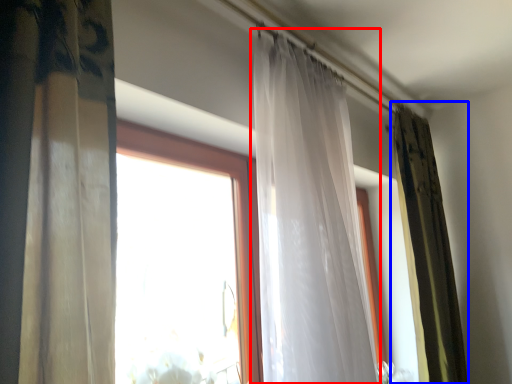
Question: Which object appears farthest to the camera in this image, curtain (highlighted by a red box) or curtain (highlighted by a blue box)?

Choices:
 (A) curtain
 (B) curtain

Answer: (B)